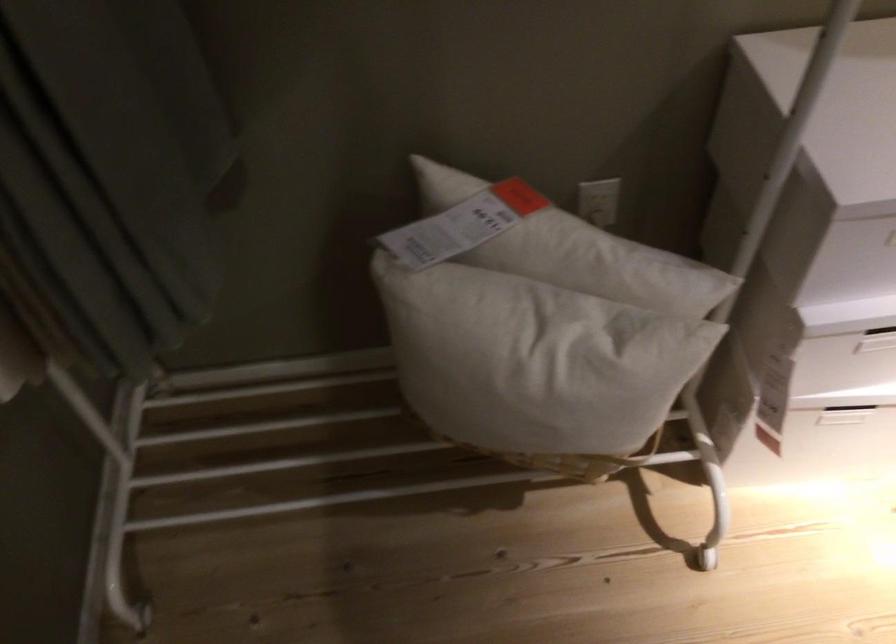
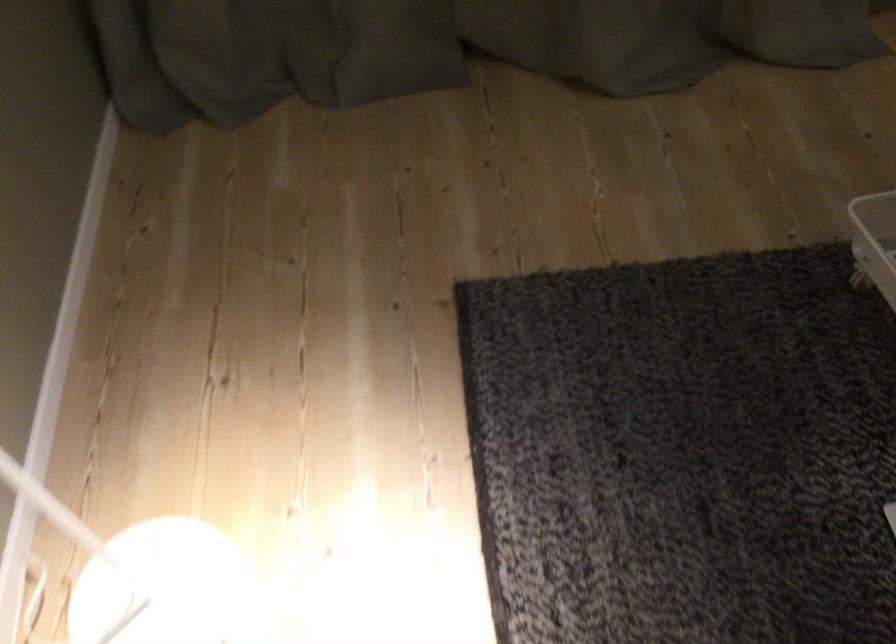
The images are taken continuously from a first-person perspective. In which direction is your viewpoint rotating?

The camera rotated toward right-down.